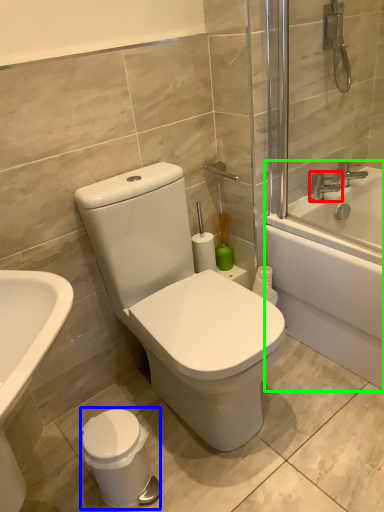
Question: Based on their relative distances, which object is farther from tap (highlighted by a red box)? Choose from porcelain (highlighted by a blue box) and bathtub (highlighted by a green box).

Choices:
 (A) porcelain
 (B) bathtub

Answer: (A)